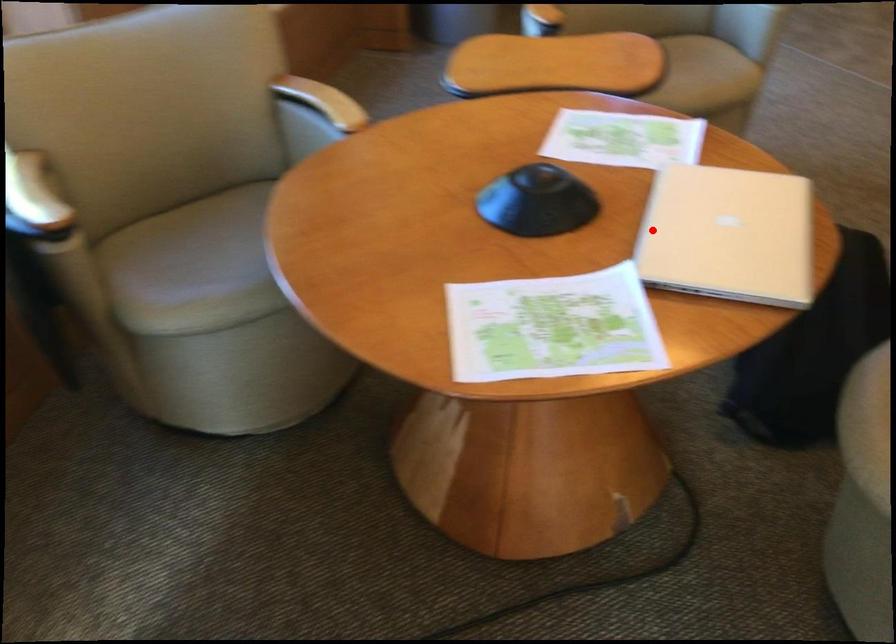
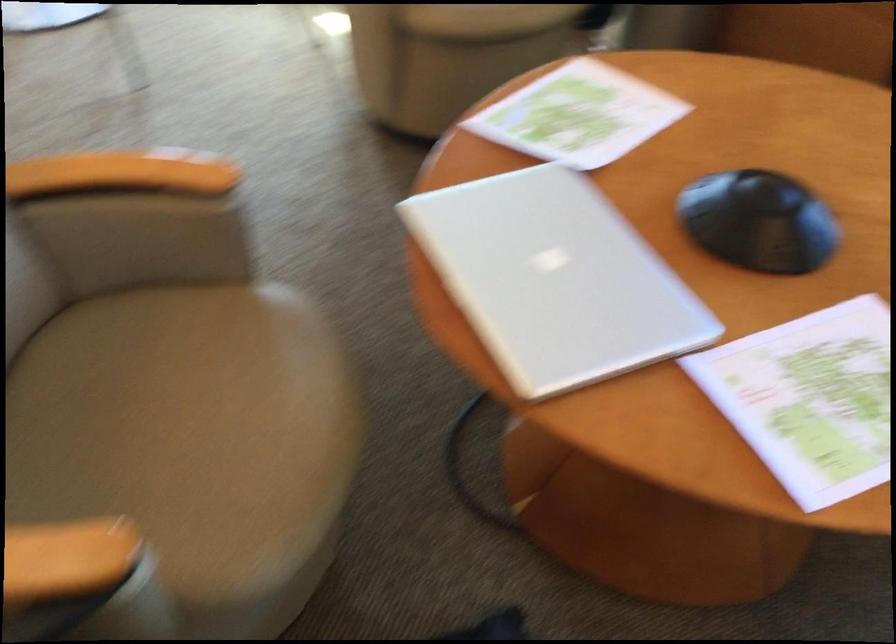
Where in the second image is the point corresponding to the highlighted location from the first image?

(555, 279)